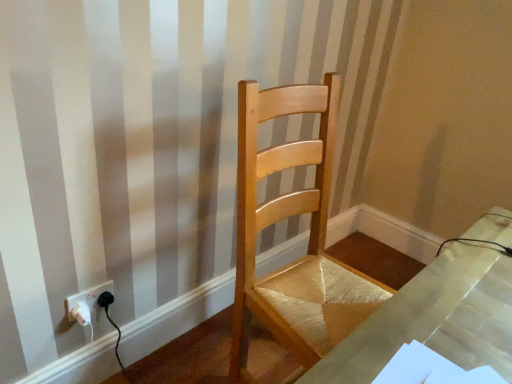
Question: From the image's perspective, is white plastic socket at lower left positioned above or below natural wood chair at center?

Choices:
 (A) above
 (B) below

Answer: (B)

Question: From a real-world perspective, relative to natural wood chair at center, is white plastic socket at lower left vertically above or below?

Choices:
 (A) below
 (B) above

Answer: (A)

Question: From their relative heights in the image, would you say white plastic socket at lower left is taller or shorter than natural wood chair at center?

Choices:
 (A) tall
 (B) short

Answer: (B)

Question: Considering the positions of natural wood chair at center and white plastic socket at lower left in the image, is natural wood chair at center taller or shorter than white plastic socket at lower left?

Choices:
 (A) short
 (B) tall

Answer: (B)

Question: From a real-world perspective, is natural wood chair at center positioned above or below white plastic socket at lower left?

Choices:
 (A) below
 (B) above

Answer: (B)

Question: In terms of size, does natural wood chair at center appear bigger or smaller than white plastic socket at lower left?

Choices:
 (A) small
 (B) big

Answer: (B)

Question: Considering the relative positions of natural wood chair at center and white plastic socket at lower left in the image provided, is natural wood chair at center to the left or to the right of white plastic socket at lower left?

Choices:
 (A) right
 (B) left

Answer: (A)